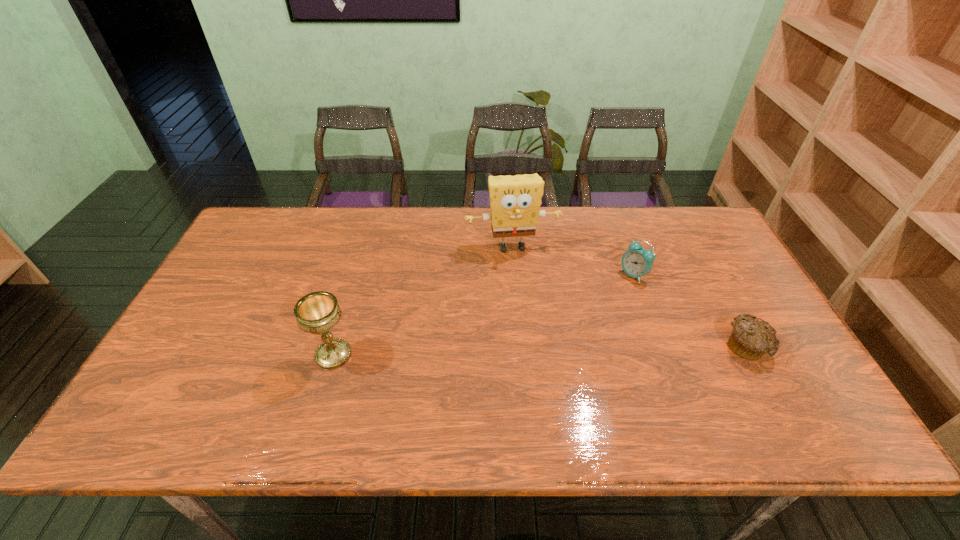
What are the coordinates of `vacant space situated 0.070m on the face of the farthest object` in the screenshot? It's located at (521, 276).

The height and width of the screenshot is (540, 960). Find the location of `vacant area situated on the face of the farthest object`. vacant area situated on the face of the farthest object is located at coordinates (540, 352).

Identify the location of blank space located on the face of the farthest object. This screenshot has width=960, height=540. (542, 362).

Identify the location of vacant space located on the face of the alarm clock. The width and height of the screenshot is (960, 540). (549, 370).

At what (x,y) coordinates should I click in order to perform the action: click on free space located on the face of the alarm clock. Please return your answer as a coordinate pair (x, y). This screenshot has height=540, width=960. Looking at the image, I should click on (603, 310).

Find the location of a particular element. The width and height of the screenshot is (960, 540). vacant space located 0.130m on the face of the alarm clock is located at coordinates (605, 308).

Where is `object located in the far edge section of the desktop`? object located in the far edge section of the desktop is located at coordinates (515, 201).

Find the location of a particular element. object located in the near edge section of the desktop is located at coordinates coord(318,312).

The image size is (960, 540). Find the location of `object located in the right edge section of the desktop`. object located in the right edge section of the desktop is located at coordinates (750, 339).

The height and width of the screenshot is (540, 960). Identify the location of free space at the far edge of the desktop. (541, 223).